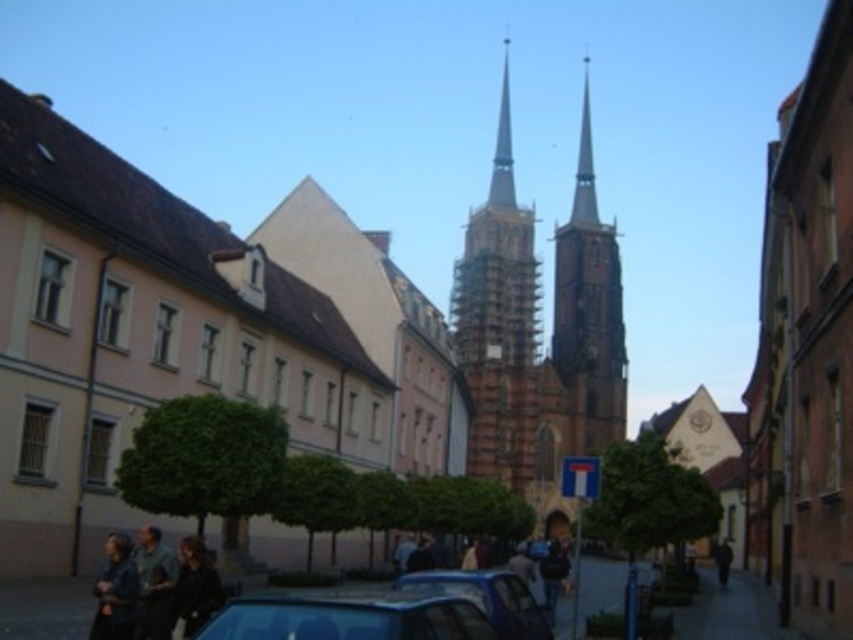
You are standing at the camera position looking at the street scene. There are two points marked in the image, one at point coordinates point (161, 609) and another at point (543, 564). Which of these two points is physically closer to you?

Point (161, 609) is closer to the camera than point (543, 564), so the point at coordinates point (161, 609) is physically closer to you.

You are a photographer standing in the European town scene. You want to capture a photo that includes both the dark blue shirt at lower left and the dark blue jeans at center. Based on their positions, which object should you adjust your camera angle to focus on first to ensure both are in the frame?

The dark blue shirt at lower left should be focused on first since it is positioned on the left side of the dark blue jeans at center, so adjusting the angle to include the leftmost object ensures both are captured.